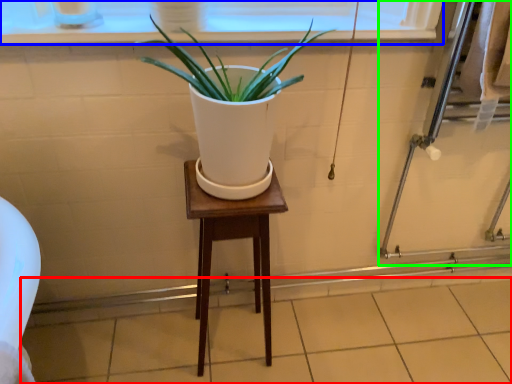
Question: Which is nearer to the tile (highlighted by a red box)? window frame (highlighted by a blue box) or screen door (highlighted by a green box).

Choices:
 (A) window frame
 (B) screen door

Answer: (B)